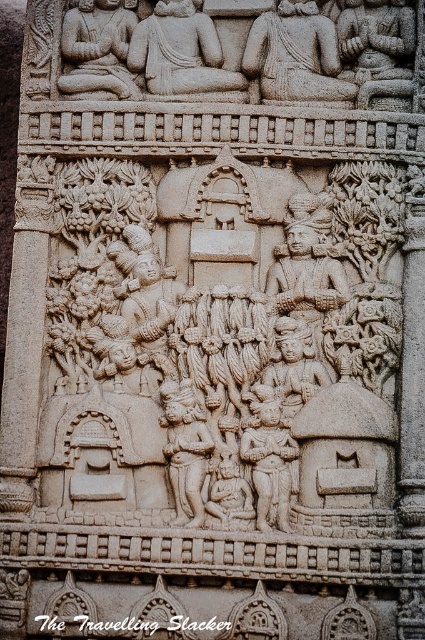
Question: Is carved stone figures at center thinner than smooth stone figure at center?

Choices:
 (A) yes
 (B) no

Answer: (B)

Question: Which is nearer to the carved stone figures at center?

Choices:
 (A) carved stone figure at center
 (B) smooth stone figure at center

Answer: (A)

Question: Can you confirm if carved stone figures at center is positioned to the right of smooth stone figure at center?

Choices:
 (A) no
 (B) yes

Answer: (A)

Question: Which point is closer to the camera taking this photo?

Choices:
 (A) (79, 92)
 (B) (130, 177)

Answer: (B)

Question: Considering the relative positions of stone statue at upper center and carved stone figure at center in the image provided, where is stone statue at upper center located with respect to carved stone figure at center?

Choices:
 (A) above
 (B) below

Answer: (A)

Question: Which point is farther to the camera?

Choices:
 (A) (240, 266)
 (B) (209, 52)

Answer: (B)